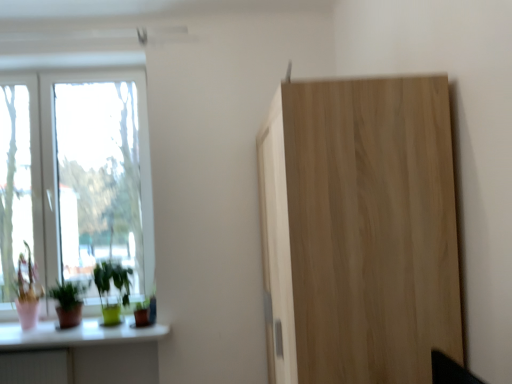
You are a GUI agent. You are given a task and a screenshot of the screen. Output one action in this format:
    pyautogui.click(x=<x>, y=<y>)
    Task: Click on the green matte plant at lower left, the 1th houseplant from the left
    
    Given the screenshot: What is the action you would take?
    pyautogui.click(x=68, y=303)

The width and height of the screenshot is (512, 384). What are the coordinates of `natural wood cupboard at right` in the screenshot? It's located at (359, 231).

How much space does white glass window at left, marked as the 1th window in a right-to-left arrangement, occupy vertically?

white glass window at left, marked as the 1th window in a right-to-left arrangement, is 5.50 feet in height.

What do you see at coordinates (110, 288) in the screenshot? I see `green glossy plant at lower left, the 1th houseplant in the right-to-left sequence` at bounding box center [110, 288].

Describe the element at coordinates (19, 179) in the screenshot. I see `transparent glass window at left, the second window viewed from the right` at that location.

Where is `green matte plant at lower left, the second houseplant positioned from the right`? This screenshot has height=384, width=512. green matte plant at lower left, the second houseplant positioned from the right is located at coordinates (68, 303).

You are a GUI agent. You are given a task and a screenshot of the screen. Output one action in this format:
    pyautogui.click(x=<x>, y=<y>)
    Task: Click on the 1st houseplant in front when counting from the transparent glass window at left, marked as the 1th window in a left-to-right arrangement
    
    Given the screenshot: What is the action you would take?
    pyautogui.click(x=110, y=288)

How distant is transparent glass window at left, marked as the 1th window in a left-to-right arrangement, from green glossy plant at lower left, acting as the second houseplant starting from the left?

They are 71.36 centimeters apart.

Is the surface of transparent glass window at left, the second window viewed from the right, in direct contact with green glossy plant at lower left, acting as the second houseplant starting from the left?

No, transparent glass window at left, the second window viewed from the right, is not touching green glossy plant at lower left, acting as the second houseplant starting from the left.

Which object is further away from the camera, transparent glass window at left, the second window viewed from the right, or green glossy plant at lower left, the 1th houseplant in the right-to-left sequence?

Positioned behind is transparent glass window at left, the second window viewed from the right.

Is green glossy plant at lower left, the 1th houseplant in the right-to-left sequence, spatially inside white glass window at left, which ranks as the 2th window in left-to-right order, or outside of it?

green glossy plant at lower left, the 1th houseplant in the right-to-left sequence, cannot be found inside white glass window at left, which ranks as the 2th window in left-to-right order.

Between green glossy plant at lower left, the 1th houseplant in the right-to-left sequence, and white glass window at left, which ranks as the 2th window in left-to-right order, which one has smaller width?

white glass window at left, which ranks as the 2th window in left-to-right order.

From the image's perspective, is green glossy plant at lower left, acting as the second houseplant starting from the left, located beneath white glass window at left, which ranks as the 2th window in left-to-right order?

Indeed, from the image's perspective, green glossy plant at lower left, acting as the second houseplant starting from the left, is shown beneath white glass window at left, which ranks as the 2th window in left-to-right order.

Starting from the white glass window at left, which ranks as the 2th window in left-to-right order, which houseplant is the 1st one in front? Please provide its 2D coordinates.

[(110, 288)]

Considering the relative sizes of white glass window at left, marked as the 1th window in a right-to-left arrangement, and green glossy plant at lower left, acting as the second houseplant starting from the left, in the image provided, is white glass window at left, marked as the 1th window in a right-to-left arrangement, shorter than green glossy plant at lower left, acting as the second houseplant starting from the left,?

No.

How far apart are white glass window at left, which ranks as the 2th window in left-to-right order, and green glossy plant at lower left, the 1th houseplant in the right-to-left sequence?

A distance of 21.25 inches exists between white glass window at left, which ranks as the 2th window in left-to-right order, and green glossy plant at lower left, the 1th houseplant in the right-to-left sequence.

From the image's perspective, is white glass window at left, which ranks as the 2th window in left-to-right order, on top of green glossy plant at lower left, acting as the second houseplant starting from the left?

Yes.

From a real-world perspective, is white glass window at left, which ranks as the 2th window in left-to-right order, located higher than green matte plant at lower left, the 1th houseplant from the left?

Correct, in the physical world, white glass window at left, which ranks as the 2th window in left-to-right order, is higher than green matte plant at lower left, the 1th houseplant from the left.

What's the angular difference between white glass window at left, which ranks as the 2th window in left-to-right order, and green matte plant at lower left, the 1th houseplant from the left,'s facing directions?

They differ by 1.31 degrees in their facing directions.

Could you tell me if white glass window at left, which ranks as the 2th window in left-to-right order, is turned towards green matte plant at lower left, the 1th houseplant from the left?

Yes, white glass window at left, which ranks as the 2th window in left-to-right order, is facing green matte plant at lower left, the 1th houseplant from the left.

Which of these two, white glass window at left, marked as the 1th window in a right-to-left arrangement, or green matte plant at lower left, the second houseplant positioned from the right, is smaller?

green matte plant at lower left, the second houseplant positioned from the right.

Is green matte plant at lower left, the 1th houseplant from the left, taller or shorter than white glass window at left, marked as the 1th window in a right-to-left arrangement?

Considering their sizes, green matte plant at lower left, the 1th houseplant from the left, has less height than white glass window at left, marked as the 1th window in a right-to-left arrangement.

From the image's perspective, which is above, green matte plant at lower left, the second houseplant positioned from the right, or white glass window at left, which ranks as the 2th window in left-to-right order?

white glass window at left, which ranks as the 2th window in left-to-right order, appears higher in the image.

Based on the photo, could you tell me if green matte plant at lower left, the second houseplant positioned from the right, is turned towards white glass window at left, which ranks as the 2th window in left-to-right order?

No.

This screenshot has width=512, height=384. Find the location of `window that is the 2nd object above the green matte plant at lower left, the second houseplant positioned from the right (from a real-world perspective)`. window that is the 2nd object above the green matte plant at lower left, the second houseplant positioned from the right (from a real-world perspective) is located at coordinates (76, 177).

The image size is (512, 384). Find the location of `the 2nd houseplant directly beneath the transparent glass window at left, marked as the 1th window in a left-to-right arrangement (from a real-world perspective)`. the 2nd houseplant directly beneath the transparent glass window at left, marked as the 1th window in a left-to-right arrangement (from a real-world perspective) is located at coordinates (68, 303).

Considering the sizes of objects transparent glass window at left, marked as the 1th window in a left-to-right arrangement, and green matte plant at lower left, the second houseplant positioned from the right, in the image provided, who is thinner, transparent glass window at left, marked as the 1th window in a left-to-right arrangement, or green matte plant at lower left, the second houseplant positioned from the right,?

With smaller width is transparent glass window at left, marked as the 1th window in a left-to-right arrangement.

Between transparent glass window at left, marked as the 1th window in a left-to-right arrangement, and green matte plant at lower left, the 1th houseplant from the left, which one has more height?

Standing taller between the two is transparent glass window at left, marked as the 1th window in a left-to-right arrangement.

Which object is further away from the camera, transparent glass window at left, marked as the 1th window in a left-to-right arrangement, or green matte plant at lower left, the second houseplant positioned from the right?

transparent glass window at left, marked as the 1th window in a left-to-right arrangement, is further from the camera.

Image resolution: width=512 pixels, height=384 pixels. What are the coordinates of `houseplant that is below the green glossy plant at lower left, acting as the second houseplant starting from the left (from the image's perspective)` in the screenshot? It's located at (68, 303).

Is green matte plant at lower left, the second houseplant positioned from the right, not near green glossy plant at lower left, the 1th houseplant in the right-to-left sequence?

No, green matte plant at lower left, the second houseplant positioned from the right, is not far from green glossy plant at lower left, the 1th houseplant in the right-to-left sequence.

Considering the points (57, 281) and (94, 274), which point is in front, point (57, 281) or point (94, 274)?

The point (94, 274) is closer.

From the image's perspective, relative to green glossy plant at lower left, acting as the second houseplant starting from the left, is green matte plant at lower left, the second houseplant positioned from the right, above or below?

Clearly, from the image's perspective, green matte plant at lower left, the second houseplant positioned from the right, is below green glossy plant at lower left, acting as the second houseplant starting from the left.

The width and height of the screenshot is (512, 384). Find the location of `houseplant that is the 1st one when counting downward from the transparent glass window at left, the second window viewed from the right (from the image's perspective)`. houseplant that is the 1st one when counting downward from the transparent glass window at left, the second window viewed from the right (from the image's perspective) is located at coordinates tap(110, 288).

Which houseplant is the 1st one when counting from the front of the white glass window at left, which ranks as the 2th window in left-to-right order? Please provide its 2D coordinates.

[(110, 288)]

Based on their spatial positions, is white glass window at left, marked as the 1th window in a right-to-left arrangement, or green matte plant at lower left, the second houseplant positioned from the right, further from natural wood cupboard at right?

The object further to natural wood cupboard at right is green matte plant at lower left, the second houseplant positioned from the right.

Based on their spatial positions, is green glossy plant at lower left, acting as the second houseplant starting from the left, or natural wood cupboard at right further from white glass window at left, which ranks as the 2th window in left-to-right order?

natural wood cupboard at right is further to white glass window at left, which ranks as the 2th window in left-to-right order.

From the image, which object appears to be farther from transparent glass window at left, the second window viewed from the right, natural wood cupboard at right or green glossy plant at lower left, acting as the second houseplant starting from the left?

Among the two, natural wood cupboard at right is located further to transparent glass window at left, the second window viewed from the right.

Looking at the image, which one is located further to natural wood cupboard at right, green matte plant at lower left, the second houseplant positioned from the right, or green glossy plant at lower left, acting as the second houseplant starting from the left?

Among the two, green matte plant at lower left, the second houseplant positioned from the right, is located further to natural wood cupboard at right.

Which object lies further to the anchor point white glass window at left, which ranks as the 2th window in left-to-right order, natural wood cupboard at right or green glossy plant at lower left, acting as the second houseplant starting from the left?

natural wood cupboard at right.

Estimate the real-world distances between objects in this image. Which object is closer to transparent glass window at left, the second window viewed from the right, white glass window at left, which ranks as the 2th window in left-to-right order, or green matte plant at lower left, the second houseplant positioned from the right?

white glass window at left, which ranks as the 2th window in left-to-right order.

Looking at the image, which one is located further to green glossy plant at lower left, the 1th houseplant in the right-to-left sequence, green matte plant at lower left, the 1th houseplant from the left, or natural wood cupboard at right?

The object further to green glossy plant at lower left, the 1th houseplant in the right-to-left sequence, is natural wood cupboard at right.

Considering their positions, is natural wood cupboard at right positioned further to white glass window at left, marked as the 1th window in a right-to-left arrangement, than green matte plant at lower left, the second houseplant positioned from the right?

natural wood cupboard at right is further to white glass window at left, marked as the 1th window in a right-to-left arrangement.

The image size is (512, 384). Find the location of `window between transparent glass window at left, the second window viewed from the right, and natural wood cupboard at right, in the horizontal direction`. window between transparent glass window at left, the second window viewed from the right, and natural wood cupboard at right, in the horizontal direction is located at coordinates (76, 177).

Identify the location of houseplant between transparent glass window at left, the second window viewed from the right, and green matte plant at lower left, the 1th houseplant from the left, from top to bottom. The width and height of the screenshot is (512, 384). (110, 288).

At what (x,y) coordinates should I click in order to perform the action: click on window located between transparent glass window at left, marked as the 1th window in a left-to-right arrangement, and green glossy plant at lower left, acting as the second houseplant starting from the left, in the left-right direction. Please return your answer as a coordinate pair (x, y). The image size is (512, 384). Looking at the image, I should click on 76,177.

The image size is (512, 384). In order to click on window between green matte plant at lower left, the second houseplant positioned from the right, and natural wood cupboard at right in this screenshot , I will do (x=76, y=177).